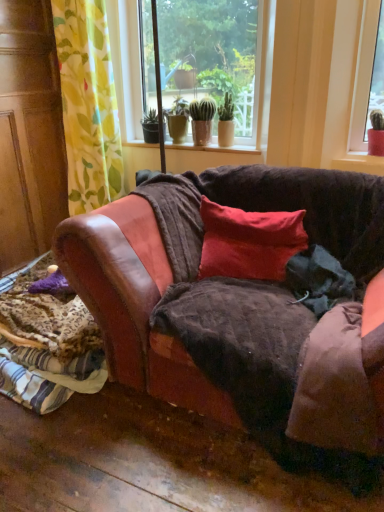
Question: Does matte ceramic pots at center have a lesser height compared to yellow-green floral fabric at left?

Choices:
 (A) no
 (B) yes

Answer: (B)

Question: Are matte ceramic pots at center and yellow-green floral fabric at left beside each other?

Choices:
 (A) no
 (B) yes

Answer: (A)

Question: From the image's perspective, would you say matte ceramic pots at center is positioned over yellow-green floral fabric at left?

Choices:
 (A) yes
 (B) no

Answer: (A)

Question: Considering the relative sizes of matte ceramic pots at center and yellow-green floral fabric at left in the image provided, is matte ceramic pots at center taller than yellow-green floral fabric at left?

Choices:
 (A) yes
 (B) no

Answer: (B)

Question: Are matte ceramic pots at center and yellow-green floral fabric at left located far from each other?

Choices:
 (A) no
 (B) yes

Answer: (B)

Question: In terms of width, does leather couch at lower left look wider or thinner when compared to yellow-green floral fabric at left?

Choices:
 (A) thin
 (B) wide

Answer: (B)

Question: From a real-world perspective, is leather couch at lower left physically located above or below yellow-green floral fabric at left?

Choices:
 (A) above
 (B) below

Answer: (B)

Question: Considering their positions, is leather couch at lower left located in front of or behind yellow-green floral fabric at left?

Choices:
 (A) front
 (B) behind

Answer: (A)

Question: From the image's perspective, relative to yellow-green floral fabric at left, is leather couch at lower left above or below?

Choices:
 (A) above
 (B) below

Answer: (B)

Question: Is red velvet pillow at center inside or outside of yellow-green floral fabric at left?

Choices:
 (A) outside
 (B) inside

Answer: (A)

Question: Is red velvet pillow at center bigger or smaller than yellow-green floral fabric at left?

Choices:
 (A) big
 (B) small

Answer: (B)

Question: Is red velvet pillow at center wider or thinner than yellow-green floral fabric at left?

Choices:
 (A) thin
 (B) wide

Answer: (A)

Question: Is red velvet pillow at center taller or shorter than yellow-green floral fabric at left?

Choices:
 (A) short
 (B) tall

Answer: (A)

Question: Choose the correct answer: Is matte ceramic pots at center inside red velvet pillow at center or outside it?

Choices:
 (A) outside
 (B) inside

Answer: (A)

Question: Looking at the image, does matte ceramic pots at center seem bigger or smaller compared to red velvet pillow at center?

Choices:
 (A) big
 (B) small

Answer: (A)